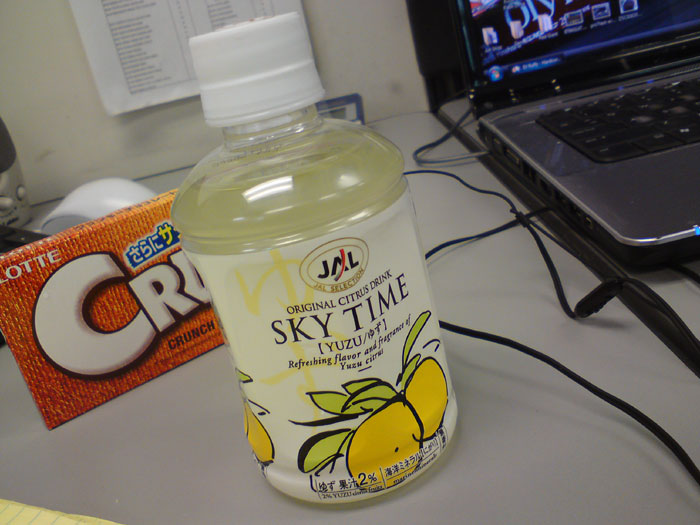
Image resolution: width=700 pixels, height=525 pixels. I want to click on laptop, so click(x=605, y=180).